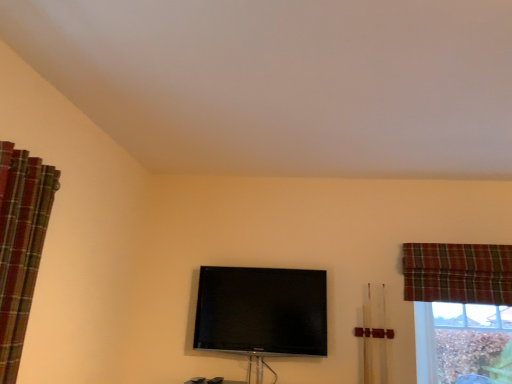
Measure the distance between plaid fabric curtain at upper right, arranged as the 1th curtain when viewed from the back, and camera.

The depth of plaid fabric curtain at upper right, arranged as the 1th curtain when viewed from the back, is 9.17 feet.

What is the approximate height of flat screen tv at center?

flat screen tv at center is 23.56 inches in height.

This screenshot has height=384, width=512. What are the coordinates of `matte black tv at center` in the screenshot? It's located at (212, 381).

Does plaid fabric curtain at left, acting as the 1th curtain starting from the front, appear on the left side of brown textured wood at lower right?

Indeed, plaid fabric curtain at left, acting as the 1th curtain starting from the front, is positioned on the left side of brown textured wood at lower right.

Does plaid fabric curtain at left, marked as the 2th curtain in a right-to-left arrangement, have a greater height compared to brown textured wood at lower right?

Indeed, plaid fabric curtain at left, marked as the 2th curtain in a right-to-left arrangement, has a greater height compared to brown textured wood at lower right.

Is plaid fabric curtain at left, marked as the 2th curtain in a right-to-left arrangement, touching brown textured wood at lower right?

No.

Is plaid fabric curtain at left, marked as the 2th curtain in a right-to-left arrangement, completely or partially outside of brown textured wood at lower right?

Absolutely, plaid fabric curtain at left, marked as the 2th curtain in a right-to-left arrangement, is external to brown textured wood at lower right.

From the image's perspective, which one is positioned higher, matte black tv at center or brown textured wood at lower right?

From the image's view, brown textured wood at lower right is above.

Is the depth of matte black tv at center greater than that of brown textured wood at lower right?

No, matte black tv at center is in front of brown textured wood at lower right.

Who is taller, matte black tv at center or brown textured wood at lower right?

brown textured wood at lower right.

Which of these two, matte black tv at center or brown textured wood at lower right, is smaller?

Smaller between the two is matte black tv at center.

From the image's perspective, between plaid fabric curtain at upper right, arranged as the 1th curtain when viewed from the back, and flat screen tv at center, who is located below?

flat screen tv at center is shown below in the image.

Visually, is plaid fabric curtain at upper right, placed as the 2th curtain when sorted from front to back, positioned to the left or to the right of flat screen tv at center?

plaid fabric curtain at upper right, placed as the 2th curtain when sorted from front to back, is positioned on flat screen tv at center's right side.

Considering their positions, is flat screen tv at center located in front of or behind brown textured wood at lower right?

Visually, flat screen tv at center is located in front of brown textured wood at lower right.

Is point (238, 286) closer to camera compared to point (493, 367)?

That is True.

Considering the positions of objects flat screen tv at center and brown textured wood at lower right in the image provided, who is more to the right, flat screen tv at center or brown textured wood at lower right?

From the viewer's perspective, brown textured wood at lower right appears more on the right side.

From a real-world perspective, is flat screen tv at center positioned over brown textured wood at lower right based on gravity?

Yes, from a real-world perspective, flat screen tv at center is above brown textured wood at lower right.

Does flat screen tv at center have a lesser width compared to matte black tv at center?

Yes.

From a real-world perspective, is flat screen tv at center positioned over matte black tv at center based on gravity?

Indeed, from a real-world perspective, flat screen tv at center stands above matte black tv at center.

From the image's perspective, is flat screen tv at center on top of matte black tv at center?

Yes, from the image's perspective, flat screen tv at center is on top of matte black tv at center.

In the scene shown: Is plaid fabric curtain at left, acting as the 1th curtain starting from the front, facing towards plaid fabric curtain at upper right, which is counted as the 1th curtain, starting from the right?

No, plaid fabric curtain at left, acting as the 1th curtain starting from the front, is not aimed at plaid fabric curtain at upper right, which is counted as the 1th curtain, starting from the right.

You are a GUI agent. You are given a task and a screenshot of the screen. Output one action in this format:
    pyautogui.click(x=<x>, y=<y>)
    Task: Click on the curtain below the plaid fabric curtain at left, the 2th curtain in the back-to-front sequence (from the image's perspective)
    The image size is (512, 384).
    Given the screenshot: What is the action you would take?
    pyautogui.click(x=458, y=273)

Which object is closer to the camera, plaid fabric curtain at left, the 2th curtain in the back-to-front sequence, or plaid fabric curtain at upper right, placed as the 2th curtain when sorted from front to back?

plaid fabric curtain at left, the 2th curtain in the back-to-front sequence, is closer to the camera.

Does plaid fabric curtain at left, marked as the 2th curtain in a right-to-left arrangement, have a lesser height compared to plaid fabric curtain at upper right, which is counted as the 1th curtain, starting from the right?

No.

This screenshot has height=384, width=512. I want to click on the 2nd curtain above the flat screen tv at center (from the image's perspective), so 20,245.

From a real-world perspective, is flat screen tv at center under plaid fabric curtain at left, marked as the 2th curtain in a right-to-left arrangement?

Yes, from a real-world perspective, flat screen tv at center is beneath plaid fabric curtain at left, marked as the 2th curtain in a right-to-left arrangement.

Between flat screen tv at center and plaid fabric curtain at left, acting as the 1th curtain starting from the front, which one has larger size?

With larger size is plaid fabric curtain at left, acting as the 1th curtain starting from the front.

Is flat screen tv at center in front of or behind plaid fabric curtain at left, acting as the 1th curtain starting from the front, in the image?

Clearly, flat screen tv at center is behind plaid fabric curtain at left, acting as the 1th curtain starting from the front.

Where is `bay window behind the plaid fabric curtain at left, acting as the 1th curtain starting from the front`? bay window behind the plaid fabric curtain at left, acting as the 1th curtain starting from the front is located at coordinates (473, 341).

You are a GUI agent. You are given a task and a screenshot of the screen. Output one action in this format:
    pyautogui.click(x=<x>, y=<y>)
    Task: Click on the furniture below the brown textured wood at lower right (from the image's perspective)
    The width and height of the screenshot is (512, 384).
    Given the screenshot: What is the action you would take?
    pyautogui.click(x=212, y=381)

Looking at this image, considering their positions, is matte black tv at center positioned further to brown textured wood at lower right than plaid fabric curtain at left, acting as the 1th curtain starting from the left?

plaid fabric curtain at left, acting as the 1th curtain starting from the left, is positioned further to the anchor brown textured wood at lower right.

Consider the image. Estimate the real-world distances between objects in this image. Which object is closer to matte black tv at center, plaid fabric curtain at left, marked as the 2th curtain in a right-to-left arrangement, or brown textured wood at lower right?

Among the two, plaid fabric curtain at left, marked as the 2th curtain in a right-to-left arrangement, is located nearer to matte black tv at center.

When comparing their distances from plaid fabric curtain at left, acting as the 1th curtain starting from the front, does brown textured wood at lower right or plaid fabric curtain at upper right, which is counted as the 1th curtain, starting from the right, seem further?

brown textured wood at lower right is further to plaid fabric curtain at left, acting as the 1th curtain starting from the front.

From the picture: Considering their positions, is brown textured wood at lower right positioned closer to flat screen tv at center than matte black tv at center?

The object closer to flat screen tv at center is matte black tv at center.

Looking at this image, which object lies further to the anchor point plaid fabric curtain at upper right, arranged as the 1th curtain when viewed from the back, brown textured wood at lower right or matte black tv at center?

matte black tv at center.

Considering their positions, is brown textured wood at lower right positioned further to plaid fabric curtain at upper right, acting as the second curtain starting from the left, than plaid fabric curtain at left, marked as the 2th curtain in a right-to-left arrangement?

Based on the image, plaid fabric curtain at left, marked as the 2th curtain in a right-to-left arrangement, appears to be further to plaid fabric curtain at upper right, acting as the second curtain starting from the left.

Estimate the real-world distances between objects in this image. Which object is closer to flat screen tv at center, plaid fabric curtain at upper right, acting as the second curtain starting from the left, or matte black tv at center?

matte black tv at center is positioned closer to the anchor flat screen tv at center.

From the image, which object appears to be nearer to plaid fabric curtain at left, the 2th curtain in the back-to-front sequence, flat screen tv at center or matte black tv at center?

Among the two, flat screen tv at center is located nearer to plaid fabric curtain at left, the 2th curtain in the back-to-front sequence.

Where is `curtain located between plaid fabric curtain at left, acting as the 1th curtain starting from the front, and brown textured wood at lower right in the left-right direction`? This screenshot has width=512, height=384. curtain located between plaid fabric curtain at left, acting as the 1th curtain starting from the front, and brown textured wood at lower right in the left-right direction is located at coordinates [x=458, y=273].

Image resolution: width=512 pixels, height=384 pixels. I want to click on television between matte black tv at center and plaid fabric curtain at upper right, arranged as the 1th curtain when viewed from the back, so click(262, 311).

Where is `furniture located between plaid fabric curtain at left, marked as the 2th curtain in a right-to-left arrangement, and plaid fabric curtain at upper right, acting as the second curtain starting from the left, in the left-right direction`? The width and height of the screenshot is (512, 384). furniture located between plaid fabric curtain at left, marked as the 2th curtain in a right-to-left arrangement, and plaid fabric curtain at upper right, acting as the second curtain starting from the left, in the left-right direction is located at coordinates (212, 381).

The height and width of the screenshot is (384, 512). In order to click on television between plaid fabric curtain at left, the 2th curtain in the back-to-front sequence, and brown textured wood at lower right, in the horizontal direction in this screenshot , I will do `click(262, 311)`.